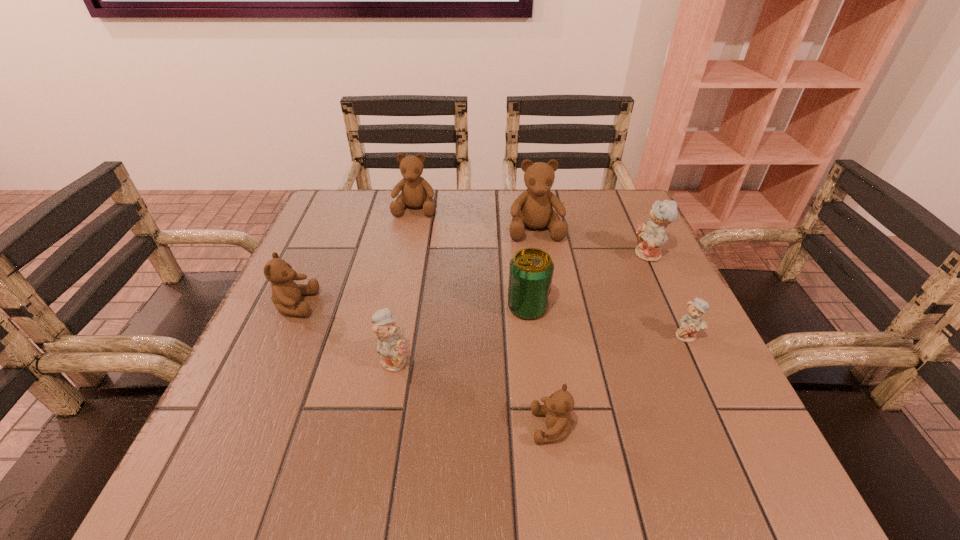
Where is `vacant point located between the beer can and the second nearest blue teddy bear`? vacant point located between the beer can and the second nearest blue teddy bear is located at coordinates (608, 321).

I want to click on empty location between the second brown teddy bear from left to right and the third farthest brown teddy bear, so click(x=355, y=256).

At what (x,y) coordinates should I click in order to perform the action: click on blank region between the third brown teddy bear from right to left and the second nearest brown teddy bear. Please return your answer as a coordinate pair (x, y). This screenshot has width=960, height=540. Looking at the image, I should click on (355, 256).

The height and width of the screenshot is (540, 960). In order to click on blank region between the second smallest brown teddy bear and the farthest blue teddy bear in this screenshot , I will do `click(471, 280)`.

Select which object appears as the fourth closest to the beer can. Please provide its 2D coordinates. Your answer should be formatted as a tuple, i.e. [(x, y)], where the tuple contains the x and y coordinates of a point satisfying the conditions above.

[(693, 321)]

You are a GUI agent. You are given a task and a screenshot of the screen. Output one action in this format:
    pyautogui.click(x=<x>, y=<y>)
    Task: Click on the object that stands as the fourth closest to the tallest teddy bear
    This screenshot has width=960, height=540.
    Given the screenshot: What is the action you would take?
    pyautogui.click(x=693, y=321)

You are a GUI agent. You are given a task and a screenshot of the screen. Output one action in this format:
    pyautogui.click(x=<x>, y=<y>)
    Task: Click on the teddy bear that is the sixth closest to the biggest blue teddy bear
    Image resolution: width=960 pixels, height=540 pixels.
    Given the screenshot: What is the action you would take?
    pyautogui.click(x=286, y=294)

Locate which teddy bear is the second closest to the leftmost teddy bear. Please provide its 2D coordinates. Your answer should be formatted as a tuple, i.e. [(x, y)], where the tuple contains the x and y coordinates of a point satisfying the conditions above.

[(416, 192)]

Where is `the third closest brown teddy bear to the second smallest blue teddy bear`? Image resolution: width=960 pixels, height=540 pixels. the third closest brown teddy bear to the second smallest blue teddy bear is located at coordinates (532, 208).

Image resolution: width=960 pixels, height=540 pixels. Find the location of `brown teddy bear that stands as the third closest to the biggest brown teddy bear`. brown teddy bear that stands as the third closest to the biggest brown teddy bear is located at coordinates (557, 407).